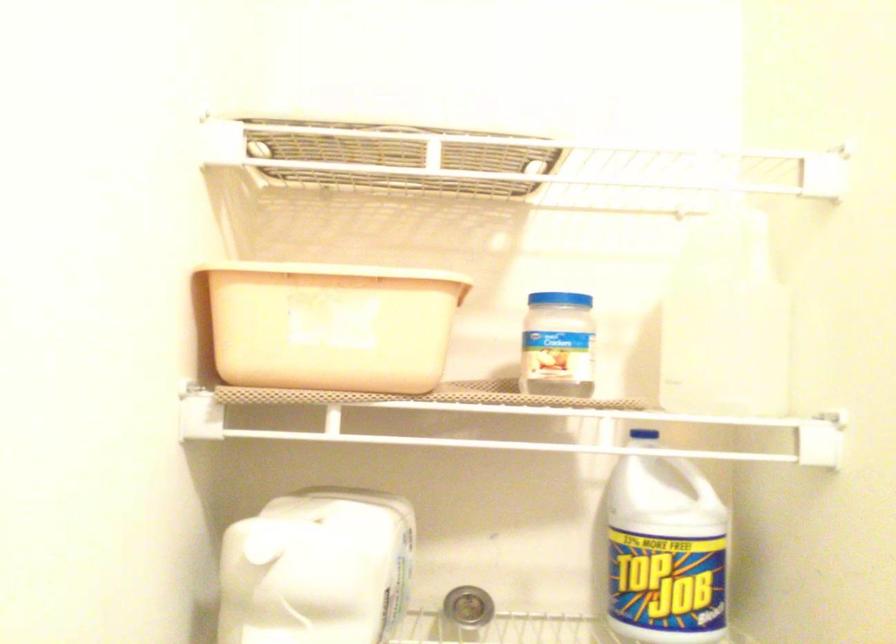
Find the location of `blue bottle cap`. blue bottle cap is located at coordinates (650, 435).